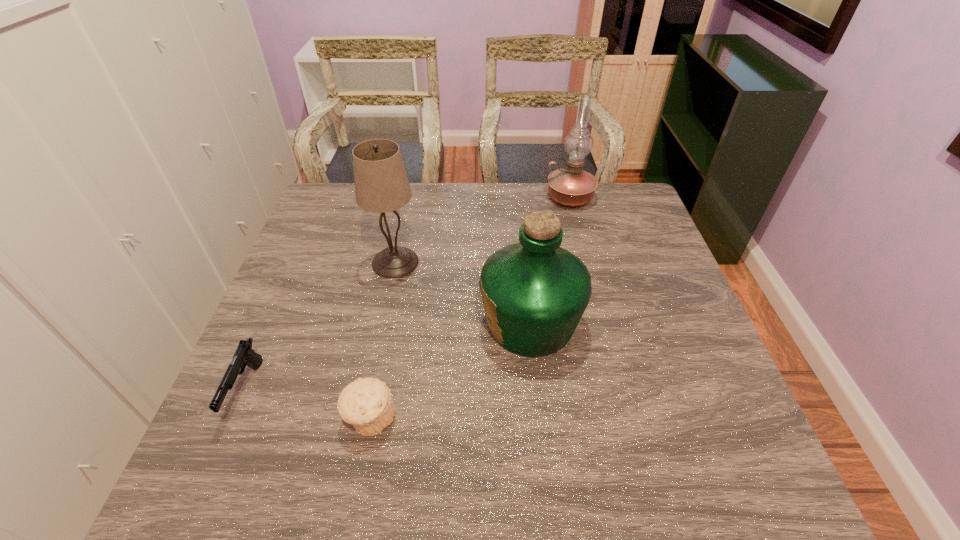
Identify the location of lampshade. (381, 185).

In order to click on oil lamp in this screenshot , I will do `click(571, 186)`.

Identify the location of liquor. (534, 292).

At what (x,y) coordinates should I click in order to perform the action: click on muffin. Please return your answer as a coordinate pair (x, y). The height and width of the screenshot is (540, 960). Looking at the image, I should click on (367, 404).

Find the location of a particular element. This screenshot has height=540, width=960. the leftmost object is located at coordinates (244, 355).

You are a GUI agent. You are given a task and a screenshot of the screen. Output one action in this format:
    pyautogui.click(x=<x>, y=<y>)
    Task: Click on the free space located on the front-facing side of the lampshade
    
    Given the screenshot: What is the action you would take?
    pyautogui.click(x=367, y=404)

Identify the location of vacant region located on the front of the farthest object. This screenshot has height=540, width=960. (582, 244).

At what (x,y) coordinates should I click in order to perform the action: click on blank space located 0.340m on the label side of the liquor. Please return your answer as a coordinate pair (x, y). This screenshot has width=960, height=540. Looking at the image, I should click on (339, 323).

In order to click on free space located 0.100m on the label side of the liquor in this screenshot , I will do `click(438, 323)`.

Where is `free space located 0.270m on the label side of the liquor`? free space located 0.270m on the label side of the liquor is located at coordinates (368, 323).